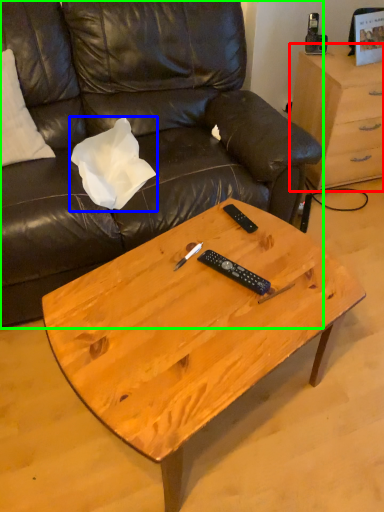
Question: Which is farther away from desk (highlighted by a red box)? pillow (highlighted by a blue box) or studio couch (highlighted by a green box)?

Choices:
 (A) pillow
 (B) studio couch

Answer: (A)